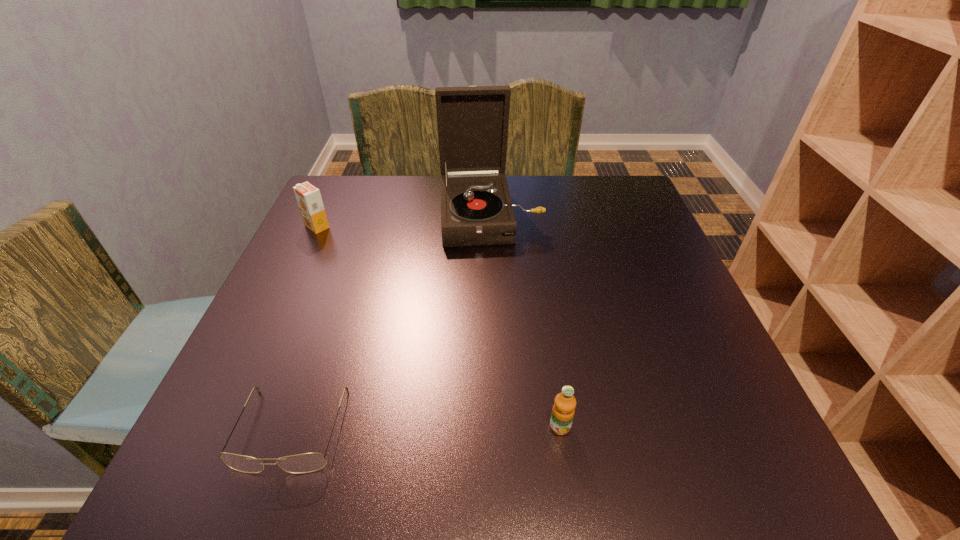
Where is `object situated at the near edge`? object situated at the near edge is located at coordinates (308, 462).

The height and width of the screenshot is (540, 960). I want to click on orange juice that is at the left edge, so click(309, 200).

Locate an element on the screen. spectacles positioned at the left edge is located at coordinates (308, 462).

The height and width of the screenshot is (540, 960). Find the location of `object present at the far left corner`. object present at the far left corner is located at coordinates (309, 200).

You are a GUI agent. You are given a task and a screenshot of the screen. Output one action in this format:
    pyautogui.click(x=<x>, y=<y>)
    Task: Click on the object that is positioned at the near left corner
    This screenshot has height=540, width=960.
    Given the screenshot: What is the action you would take?
    pyautogui.click(x=308, y=462)

The image size is (960, 540). I want to click on free space at the far edge of the desktop, so click(572, 198).

This screenshot has width=960, height=540. Identify the location of vacant area at the near edge. (578, 440).

Where is `free space at the left edge of the desktop`? This screenshot has height=540, width=960. free space at the left edge of the desktop is located at coordinates click(x=335, y=305).

The image size is (960, 540). Identify the location of vacant space at the right edge of the desktop. (709, 363).

Find the location of `free space at the near left corner of the desktop`. free space at the near left corner of the desktop is located at coordinates (253, 448).